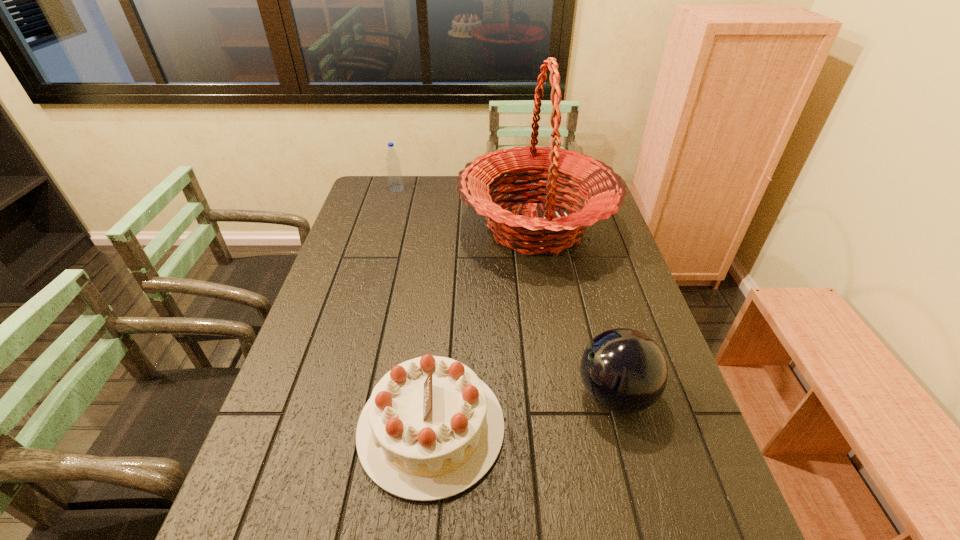
Where is `free space between the basket and the birthday cake`? This screenshot has height=540, width=960. free space between the basket and the birthday cake is located at coordinates (484, 327).

Choose which object is the second nearest neighbor to the basket. Please provide its 2D coordinates. Your answer should be formatted as a tuple, i.e. [(x, y)], where the tuple contains the x and y coordinates of a point satisfying the conditions above.

[(623, 370)]

Identify which object is the nearest to the leftmost object. Please provide its 2D coordinates. Your answer should be formatted as a tuple, i.e. [(x, y)], where the tuple contains the x and y coordinates of a point satisfying the conditions above.

[(552, 234)]

At what (x,y) coordinates should I click in order to perform the action: click on free space in the image that satisfies the following two spatial constraints: 1. on the front side of the water bottle; 2. on the right side of the basket. Please return your answer as a coordinate pair (x, y). The width and height of the screenshot is (960, 540). Looking at the image, I should click on (386, 227).

Find the location of a particular element. free spot that satisfies the following two spatial constraints: 1. on the front side of the tallest object; 2. on the right side of the water bottle is located at coordinates point(386,227).

What are the coordinates of `vacant space that satisfies the following two spatial constraints: 1. on the front side of the leftmost object; 2. on the left side of the basket` in the screenshot? It's located at (386, 227).

Where is `vacant point that satisfies the following two spatial constraints: 1. on the front side of the basket; 2. on the left side of the leftmost object`? The height and width of the screenshot is (540, 960). vacant point that satisfies the following two spatial constraints: 1. on the front side of the basket; 2. on the left side of the leftmost object is located at coordinates (386, 227).

Find the location of a particular element. Image resolution: width=960 pixels, height=540 pixels. vacant region that satisfies the following two spatial constraints: 1. on the front side of the leftmost object; 2. on the right side of the birthday cake is located at coordinates (330, 427).